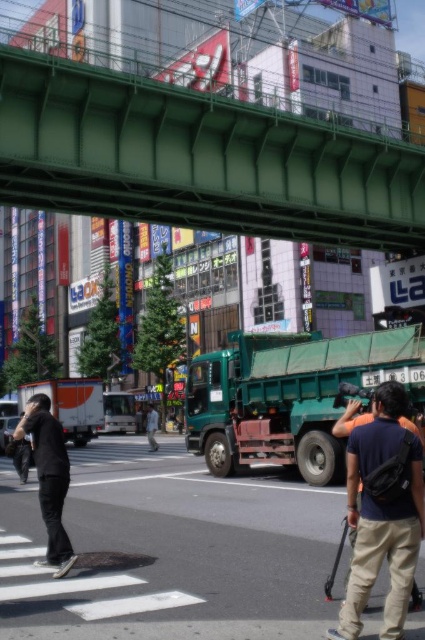
You are a delivery driver who needs to pass under the green metallic bridge at upper center with your metallic truck at center. Based on the scene, can your truck pass under the bridge without hitting it?

The metallic truck at center is not as tall as green metallic bridge at upper center, so it can pass under the bridge without hitting it.

You are a delivery person carrying a package that requires a 20 meter clearance to safely pass through. You need to move from the black matte shirt at left to the light blue jeans at center. Can you safely navigate this path with your package?

The distance between the black matte shirt at left and light blue jeans at center is 21.81 meters, which exceeds the required 20 meter clearance. Therefore, you can safely navigate the path with your package.

You are a pedestrian standing on the street in the image. You see a person wearing a black matte shirt at left and light blue jeans at center. Which clothing item is positioned more to the right?

The black matte shirt at left is positioned more to the right than the light blue jeans at center.